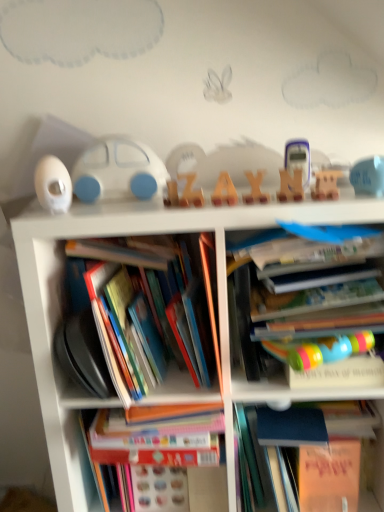
Question: From a real-world perspective, is white matte toy car at center over white plastic bookcase at center?

Choices:
 (A) no
 (B) yes

Answer: (B)

Question: Does white matte toy car at center turn towards white plastic bookcase at center?

Choices:
 (A) yes
 (B) no

Answer: (B)

Question: Does white matte toy car at center appear on the left side of white plastic bookcase at center?

Choices:
 (A) no
 (B) yes

Answer: (B)

Question: Is white matte toy car at center far away from white plastic bookcase at center?

Choices:
 (A) yes
 (B) no

Answer: (B)

Question: Does white matte toy car at center have a larger size compared to white plastic bookcase at center?

Choices:
 (A) no
 (B) yes

Answer: (A)

Question: From a real-world perspective, does white matte toy car at center sit lower than white plastic bookcase at center?

Choices:
 (A) no
 (B) yes

Answer: (A)

Question: Considering the relative sizes of blue matte book at right, which appears as the 1th book when viewed from the right, and translucent plastic calculator at center, which is counted as the 3th toy, starting from the right, in the image provided, is blue matte book at right, which appears as the 1th book when viewed from the right, bigger than translucent plastic calculator at center, which is counted as the 3th toy, starting from the right,?

Choices:
 (A) no
 (B) yes

Answer: (B)

Question: Could translucent plastic calculator at center, which is counted as the 3th toy, starting from the right, be considered to be inside blue matte book at right, which appears as the 1th book when viewed from the right?

Choices:
 (A) yes
 (B) no

Answer: (B)

Question: From the image's perspective, is blue matte book at right, positioned as the 4th book in left-to-right order, located above translucent plastic calculator at center, positioned as the 3th toy in left-to-right order?

Choices:
 (A) yes
 (B) no

Answer: (B)

Question: From a real-world perspective, is blue matte book at right, positioned as the 4th book in left-to-right order, below translucent plastic calculator at center, positioned as the 3th toy in left-to-right order?

Choices:
 (A) yes
 (B) no

Answer: (A)

Question: Considering the relative positions of blue matte book at right, which appears as the 1th book when viewed from the right, and translucent plastic calculator at center, positioned as the 3th toy in left-to-right order, in the image provided, is blue matte book at right, which appears as the 1th book when viewed from the right, to the left of translucent plastic calculator at center, positioned as the 3th toy in left-to-right order, from the viewer's perspective?

Choices:
 (A) yes
 (B) no

Answer: (B)

Question: Is blue matte book at right, positioned as the 4th book in left-to-right order, taller than translucent plastic calculator at center, positioned as the 3th toy in left-to-right order?

Choices:
 (A) yes
 (B) no

Answer: (A)

Question: Is blue matte book at right, positioned as the 4th book in left-to-right order, next to wooden letter at center, acting as the fourth toy starting from the left?

Choices:
 (A) no
 (B) yes

Answer: (A)